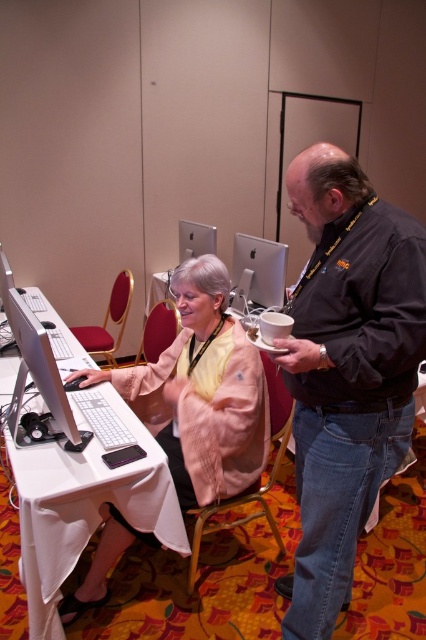
You are a visitor in the conference room and need to reach the satin silver monitor at center to adjust its settings. However, there is a matte pink jacket at center in your way. Based on their positions, can you easily access the monitor without moving the jacket?

The matte pink jacket at center is closer to the viewer than the satin silver monitor at center, so you would need to move the jacket to access the monitor.

You are standing in the conference room and want to hand a document to the person wearing the dark gray shirt at center. Can you reach them without moving closer than 1 meter?

The dark gray shirt at center is 1.19 meters away from the viewer. Since the distance is more than 1 meter, you cannot reach them without moving closer.